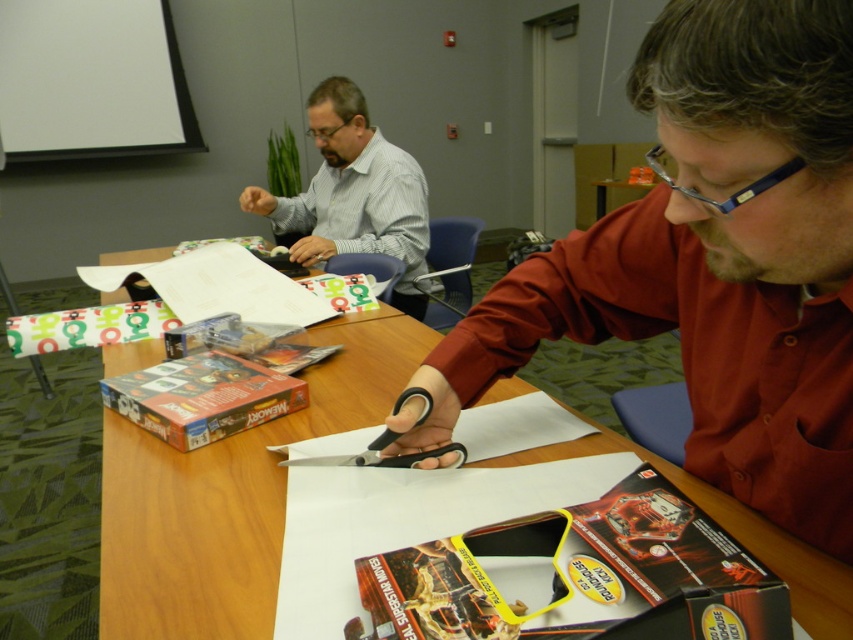
You are organizing a craft activity and need to place a decorative mat under the white paper at center. The mat you have is 1 meter wide. Can the mat fit under the wooden table at center if placed properly?

The wooden table at center is positioned on the right side of white paper at center. Since the mat is 1 meter wide and the white paper is centered, the mat can be placed under the white paper at center with enough space to also accommodate the wooden table at center on its right side.

You are a delivery person who needs to place a package on the table in the conference room. The package is 15 inches long. Can you safely place it on the table without it hanging off the edge near the matte black scissors at center?

The matte black scissors at center is 14.87 inches away from the camera. Since the package is 15 inches long, placing it near the scissors would cause the package to extend beyond the table edge by approximately 0.13 inches. Therefore, it might not be safe to place the package there without it hanging off slightly.

You are organizing a craft activity and need to hand out scissors to participants. There are two items on the table, the matte gray shirt at upper left and the black plastic scissors at center. Which item should you pick up first to ensure you can reach the scissors without moving anything else?

You should pick up the matte gray shirt at upper left first because the black plastic scissors at center is behind it, so moving the shirt will allow access to the scissors.